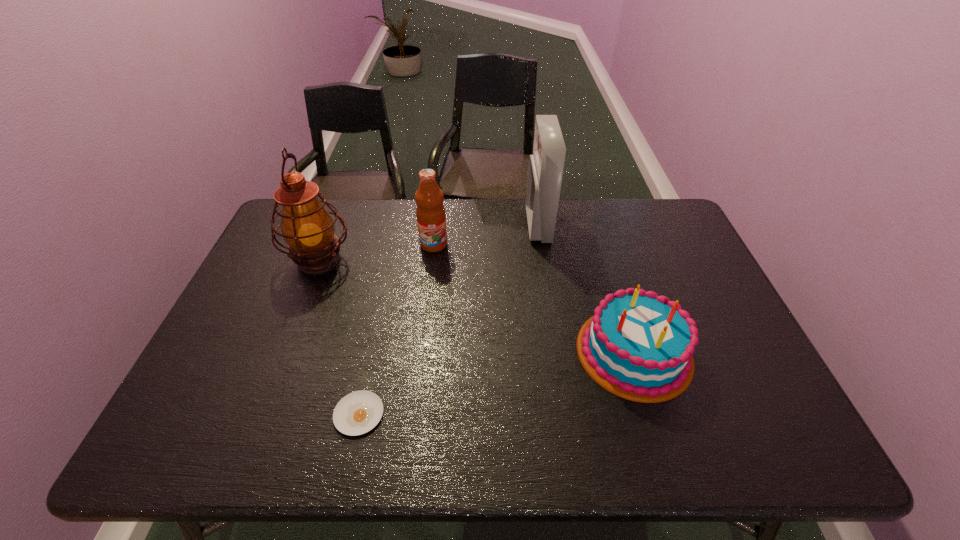
Find the location of a particular element. This screenshot has width=960, height=540. vacant position located 0.170m on the front-facing side of the second object from right to left is located at coordinates (477, 226).

Locate an element on the screen. Image resolution: width=960 pixels, height=540 pixels. vacant space located on the front-facing side of the second object from right to left is located at coordinates (489, 226).

Locate an element on the screen. vacant space located on the front label of the fruit juice is located at coordinates (427, 300).

This screenshot has height=540, width=960. In order to click on vacant region located 0.110m on the right of the rightmost object in this screenshot , I will do `click(735, 352)`.

You are a GUI agent. You are given a task and a screenshot of the screen. Output one action in this format:
    pyautogui.click(x=<x>, y=<y>)
    Task: Click on the blank space located on the left of the egg yolk
    Image resolution: width=960 pixels, height=540 pixels.
    Given the screenshot: What is the action you would take?
    pyautogui.click(x=246, y=414)

At what (x,y) coordinates should I click in order to perform the action: click on oil lamp that is at the far edge. Please return your answer as a coordinate pair (x, y). The height and width of the screenshot is (540, 960). Looking at the image, I should click on (307, 227).

Find the location of a particular element. The image size is (960, 540). the first-aid kit that is at the far edge is located at coordinates (546, 165).

Where is `fruit juice that is at the far edge`? fruit juice that is at the far edge is located at coordinates (431, 218).

Locate an element on the screen. The width and height of the screenshot is (960, 540). object at the near edge is located at coordinates (357, 413).

I want to click on object present at the left edge, so click(x=307, y=227).